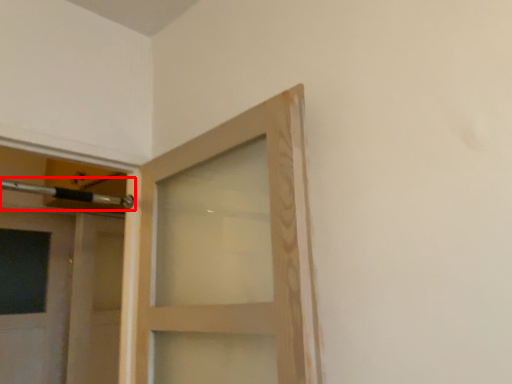
Question: From the image's perspective, where is door handle (annotated by the red box) located in relation to door in the image?

Choices:
 (A) below
 (B) above

Answer: (B)